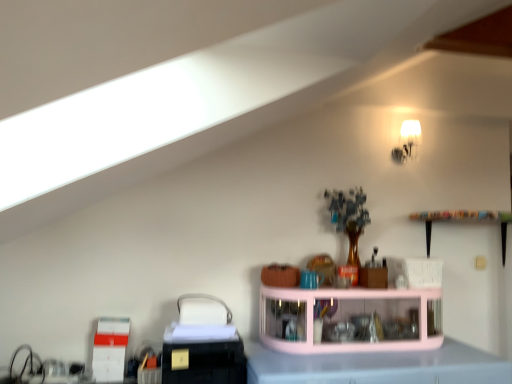
Question: Are white frosted glass lampshade at upper right and pink glossy counter top at center located far from each other?

Choices:
 (A) yes
 (B) no

Answer: (A)

Question: Is the surface of white frosted glass lampshade at upper right in direct contact with pink glossy counter top at center?

Choices:
 (A) no
 (B) yes

Answer: (A)

Question: Is white frosted glass lampshade at upper right shorter than pink glossy counter top at center?

Choices:
 (A) yes
 (B) no

Answer: (A)

Question: From the image's perspective, does white frosted glass lampshade at upper right appear lower than pink glossy counter top at center?

Choices:
 (A) yes
 (B) no

Answer: (B)

Question: Does white frosted glass lampshade at upper right have a greater width compared to pink glossy counter top at center?

Choices:
 (A) yes
 (B) no

Answer: (B)

Question: Based on their sizes in the image, would you say white frosted glass lampshade at upper right is bigger or smaller than pink glossy counter top at center?

Choices:
 (A) small
 (B) big

Answer: (A)

Question: From a real-world perspective, is white frosted glass lampshade at upper right positioned above or below pink glossy counter top at center?

Choices:
 (A) below
 (B) above

Answer: (B)

Question: Visually, is white frosted glass lampshade at upper right positioned to the left or to the right of pink glossy counter top at center?

Choices:
 (A) right
 (B) left

Answer: (A)

Question: Considering the positions of point (408, 139) and point (330, 382), is point (408, 139) closer or farther from the camera than point (330, 382)?

Choices:
 (A) closer
 (B) farther

Answer: (B)

Question: Is point (388, 291) closer or farther from the camera than point (399, 153)?

Choices:
 (A) closer
 (B) farther

Answer: (A)

Question: In the image, is pink glass shelf at center positioned in front of or behind white frosted glass lampshade at upper right?

Choices:
 (A) front
 (B) behind

Answer: (A)

Question: In terms of width, does pink glass shelf at center look wider or thinner when compared to white frosted glass lampshade at upper right?

Choices:
 (A) thin
 (B) wide

Answer: (B)

Question: Which is correct: pink glass shelf at center is inside white frosted glass lampshade at upper right, or outside of it?

Choices:
 (A) inside
 (B) outside

Answer: (B)

Question: Based on their positions, is pink glossy counter top at center located to the left or right of white frosted glass lampshade at upper right?

Choices:
 (A) right
 (B) left

Answer: (B)

Question: Considering their positions, is pink glossy counter top at center located in front of or behind white frosted glass lampshade at upper right?

Choices:
 (A) behind
 (B) front

Answer: (B)